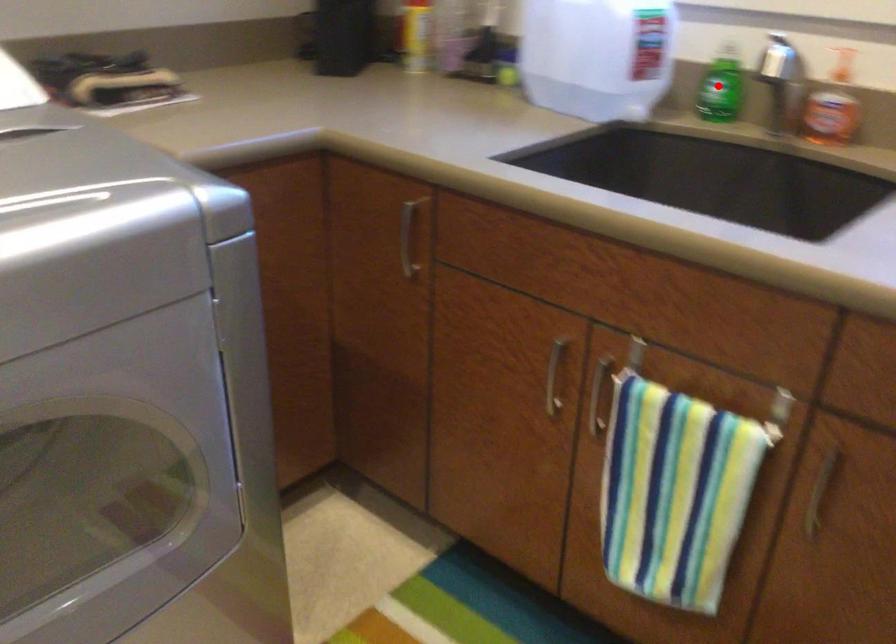
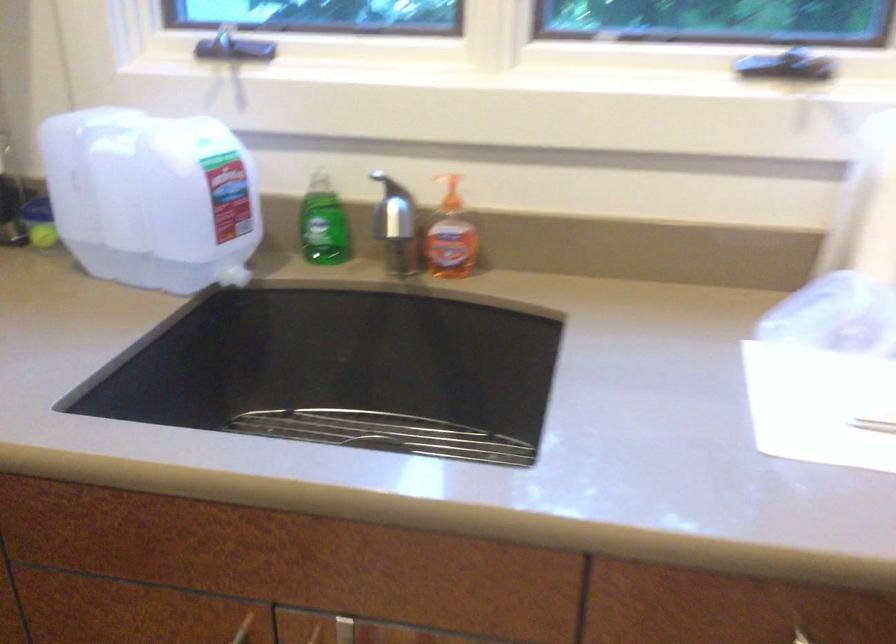
Question: I am providing you with two images of the same scene from different viewpoints. A red point is shown in image1. For the corresponding object point in image2, is it positioned nearer or farther from the camera?

Choices:
 (A) Nearer
 (B) Farther

Answer: (A)